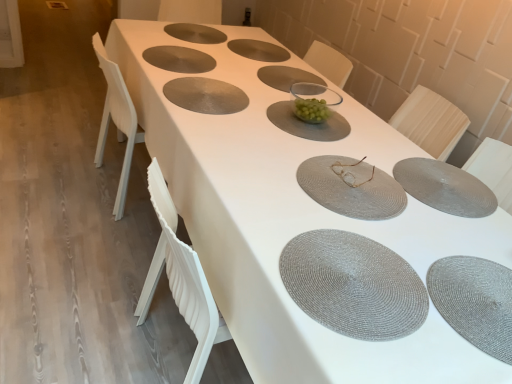
Locate an element on the screen. The image size is (512, 384). vacant space behind gray woven placemat at center, the 2th tableware in the bottom-to-top sequence is located at coordinates (384, 136).